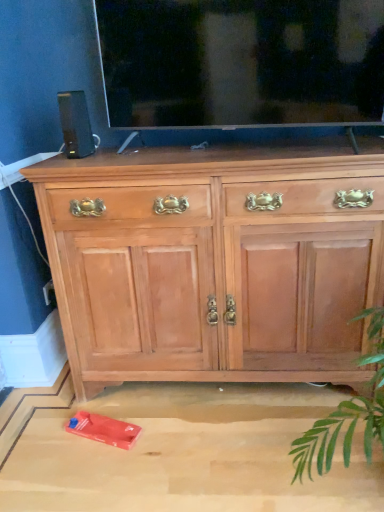
Question: Considering the relative sizes of black plastic speaker at upper left and transparent glass tv at upper center in the image provided, is black plastic speaker at upper left thinner than transparent glass tv at upper center?

Choices:
 (A) no
 (B) yes

Answer: (B)

Question: From the image's perspective, would you say black plastic speaker at upper left is shown under transparent glass tv at upper center?

Choices:
 (A) no
 (B) yes

Answer: (B)

Question: Is black plastic speaker at upper left further to the viewer compared to transparent glass tv at upper center?

Choices:
 (A) yes
 (B) no

Answer: (A)

Question: Is black plastic speaker at upper left facing towards transparent glass tv at upper center?

Choices:
 (A) no
 (B) yes

Answer: (A)

Question: Can you confirm if black plastic speaker at upper left is taller than transparent glass tv at upper center?

Choices:
 (A) no
 (B) yes

Answer: (A)

Question: Is black plastic speaker at upper left in front of transparent glass tv at upper center?

Choices:
 (A) no
 (B) yes

Answer: (A)

Question: Is the position of light wood cabinet at center more distant than that of black plastic speaker at upper left?

Choices:
 (A) yes
 (B) no

Answer: (B)

Question: Can you confirm if light wood cabinet at center is shorter than black plastic speaker at upper left?

Choices:
 (A) no
 (B) yes

Answer: (A)

Question: Is light wood cabinet at center turned away from black plastic speaker at upper left?

Choices:
 (A) yes
 (B) no

Answer: (B)

Question: Can black plastic speaker at upper left be found inside light wood cabinet at center?

Choices:
 (A) yes
 (B) no

Answer: (B)

Question: From the image's perspective, would you say light wood cabinet at center is positioned over black plastic speaker at upper left?

Choices:
 (A) no
 (B) yes

Answer: (A)

Question: Does light wood cabinet at center appear on the right side of black plastic speaker at upper left?

Choices:
 (A) no
 (B) yes

Answer: (B)

Question: Is transparent glass tv at upper center aimed at light wood cabinet at center?

Choices:
 (A) no
 (B) yes

Answer: (A)